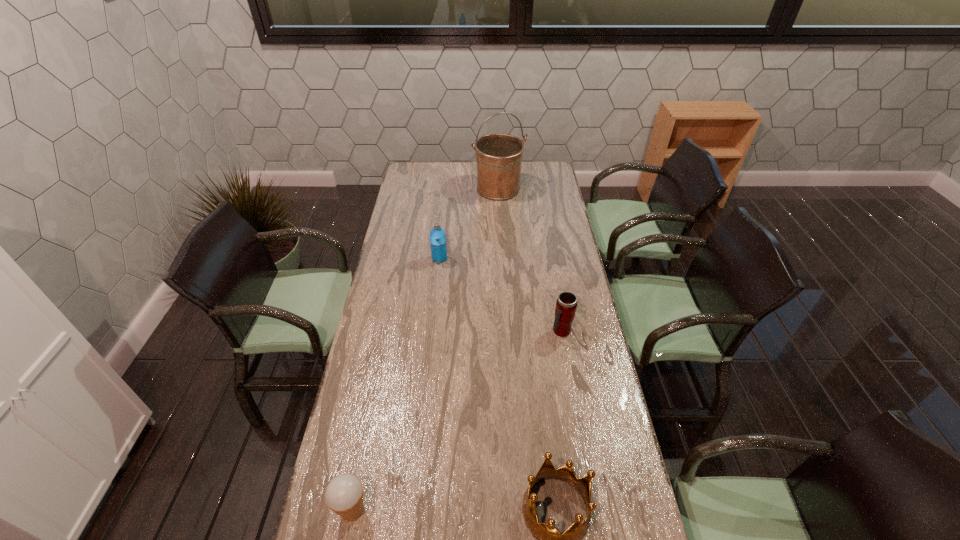
The image size is (960, 540). What are the coordinates of `free space located 0.400m on the right of the icecream` in the screenshot? It's located at (518, 510).

Image resolution: width=960 pixels, height=540 pixels. Identify the location of object present at the far edge. (499, 156).

You are a GUI agent. You are given a task and a screenshot of the screen. Output one action in this format:
    pyautogui.click(x=<x>, y=<y>)
    Task: Click on the object that is at the left edge
    The height and width of the screenshot is (540, 960).
    Given the screenshot: What is the action you would take?
    pyautogui.click(x=344, y=494)

Where is `object present at the right edge`? This screenshot has height=540, width=960. object present at the right edge is located at coordinates (566, 304).

In the image, there is a desktop. Identify the location of free space at the left edge. This screenshot has height=540, width=960. (389, 281).

In the image, there is a desktop. At what (x,y) coordinates should I click in order to perform the action: click on vacant area at the right edge. Please return your answer as a coordinate pair (x, y). This screenshot has width=960, height=540. Looking at the image, I should click on (615, 425).

Image resolution: width=960 pixels, height=540 pixels. In order to click on vacant region at the far right corner of the desktop in this screenshot , I will do `click(534, 167)`.

You are a GUI agent. You are given a task and a screenshot of the screen. Output one action in this format:
    pyautogui.click(x=<x>, y=<y>)
    Task: Click on the free point between the farther thermos bottle and the right thermos bottle
    This screenshot has height=540, width=960.
    Given the screenshot: What is the action you would take?
    pyautogui.click(x=500, y=295)

Where is `free space between the second object from left to right and the nearer thermos bottle`? This screenshot has width=960, height=540. free space between the second object from left to right and the nearer thermos bottle is located at coordinates (500, 295).

Identify the location of free area in between the farthest object and the right thermos bottle. click(x=530, y=260).